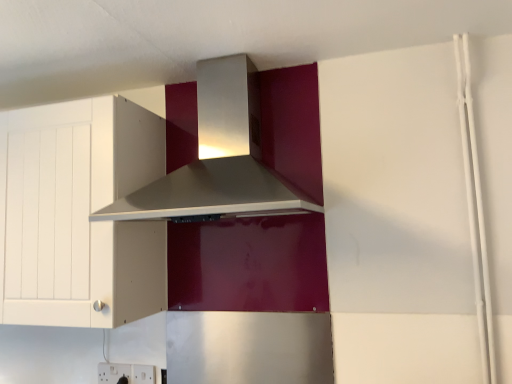
Describe the element at coordinates (113, 372) in the screenshot. I see `white plastic electric outlet at lower left, marked as the 1th electric outlet in a left-to-right arrangement` at that location.

Where is `white plastic electric outlet at lower center, placed as the 1th electric outlet when sorted from right to left`? Image resolution: width=512 pixels, height=384 pixels. white plastic electric outlet at lower center, placed as the 1th electric outlet when sorted from right to left is located at coordinates (143, 374).

What do you see at coordinates (143, 374) in the screenshot?
I see `white plastic electric outlet at lower center, placed as the 1th electric outlet when sorted from right to left` at bounding box center [143, 374].

The height and width of the screenshot is (384, 512). Find the location of `satin silver range hood at upper center`. satin silver range hood at upper center is located at coordinates (211, 194).

I want to click on white plastic electric outlet at lower left, marked as the 1th electric outlet in a left-to-right arrangement, so pos(113,372).

Considering the sizes of white plastic electric outlet at lower left, marked as the 1th electric outlet in a left-to-right arrangement, and white matte cabinet at left in the image, is white plastic electric outlet at lower left, marked as the 1th electric outlet in a left-to-right arrangement, taller or shorter than white matte cabinet at left?

Considering their sizes, white plastic electric outlet at lower left, marked as the 1th electric outlet in a left-to-right arrangement, has less height than white matte cabinet at left.

From a real-world perspective, is white plastic electric outlet at lower left, marked as the 1th electric outlet in a left-to-right arrangement, located beneath white matte cabinet at left?

Yes, from a real-world perspective, white plastic electric outlet at lower left, marked as the 1th electric outlet in a left-to-right arrangement, is under white matte cabinet at left.

Based on their positions, is white plastic electric outlet at lower left, marked as the 1th electric outlet in a left-to-right arrangement, located to the left or right of satin silver range hood at upper center?

Based on their positions, white plastic electric outlet at lower left, marked as the 1th electric outlet in a left-to-right arrangement, is located to the left of satin silver range hood at upper center.

From a real-world perspective, is white plastic electric outlet at lower left, marked as the 1th electric outlet in a left-to-right arrangement, located higher than satin silver range hood at upper center?

Actually, white plastic electric outlet at lower left, marked as the 1th electric outlet in a left-to-right arrangement, is physically below satin silver range hood at upper center in the real world.

How different are the orientations of white plastic electric outlet at lower left, the second electric outlet viewed from the right, and satin silver range hood at upper center in degrees?

1.5 degrees separate the facing orientations of white plastic electric outlet at lower left, the second electric outlet viewed from the right, and satin silver range hood at upper center.

Is satin silver range hood at upper center far away from white matte cabinet at left?

They are positioned close to each other.

From a real-world perspective, which object stands above the other?

From a 3D spatial view, satin silver range hood at upper center is above.

Considering the relative sizes of satin silver range hood at upper center and white matte cabinet at left in the image provided, is satin silver range hood at upper center wider than white matte cabinet at left?

Indeed, satin silver range hood at upper center has a greater width compared to white matte cabinet at left.

Is white plastic electric outlet at lower center, placed as the 1th electric outlet when sorted from right to left, far away from white plastic electric outlet at lower left, marked as the 1th electric outlet in a left-to-right arrangement?

That's not correct — white plastic electric outlet at lower center, placed as the 1th electric outlet when sorted from right to left, is a little close to white plastic electric outlet at lower left, marked as the 1th electric outlet in a left-to-right arrangement.

Between point (137, 373) and point (116, 364), which one is positioned in front?

The point (137, 373) is closer to the camera.

Could you tell me if white plastic electric outlet at lower center, the second electric outlet from the left, is turned towards white plastic electric outlet at lower left, marked as the 1th electric outlet in a left-to-right arrangement?

No, white plastic electric outlet at lower center, the second electric outlet from the left, is not facing towards white plastic electric outlet at lower left, marked as the 1th electric outlet in a left-to-right arrangement.

How many degrees apart are the facing directions of white plastic electric outlet at lower center, placed as the 1th electric outlet when sorted from right to left, and white plastic electric outlet at lower left, the second electric outlet viewed from the right?

They differ by 0.0294 degrees in their facing directions.

Is white plastic electric outlet at lower center, placed as the 1th electric outlet when sorted from right to left, with white matte cabinet at left?

No, white plastic electric outlet at lower center, placed as the 1th electric outlet when sorted from right to left, is not with white matte cabinet at left.

Image resolution: width=512 pixels, height=384 pixels. What are the coordinates of `cabinetry that appears in front of the white plastic electric outlet at lower center, the second electric outlet from the left` in the screenshot? It's located at (78, 214).

Measure the distance between white plastic electric outlet at lower center, placed as the 1th electric outlet when sorted from right to left, and white matte cabinet at left.

white plastic electric outlet at lower center, placed as the 1th electric outlet when sorted from right to left, and white matte cabinet at left are 24.44 inches apart from each other.

Considering the sizes of objects white matte cabinet at left and white plastic electric outlet at lower left, marked as the 1th electric outlet in a left-to-right arrangement, in the image provided, who is wider, white matte cabinet at left or white plastic electric outlet at lower left, marked as the 1th electric outlet in a left-to-right arrangement,?

white matte cabinet at left.

Would you say white matte cabinet at left is a long distance from white plastic electric outlet at lower left, marked as the 1th electric outlet in a left-to-right arrangement?

No.

Are white plastic electric outlet at lower center, the second electric outlet from the left, and satin silver range hood at upper center making contact?

white plastic electric outlet at lower center, the second electric outlet from the left, is not next to satin silver range hood at upper center, and they're not touching.

Is point (142, 374) positioned in front of point (102, 216)?

No, (142, 374) is behind (102, 216).

Looking at this image, is satin silver range hood at upper center a part of white plastic electric outlet at lower center, the second electric outlet from the left?

No, white plastic electric outlet at lower center, the second electric outlet from the left, does not contain satin silver range hood at upper center.

Can you confirm if white plastic electric outlet at lower center, placed as the 1th electric outlet when sorted from right to left, is taller than satin silver range hood at upper center?

In fact, white plastic electric outlet at lower center, placed as the 1th electric outlet when sorted from right to left, may be shorter than satin silver range hood at upper center.

From the white matte cabinet at left, count 2nd electric outlets backward and point to it. Please provide its 2D coordinates.

[(113, 372)]

This screenshot has width=512, height=384. What are the coordinates of `home appliance that is above the white plastic electric outlet at lower left, the second electric outlet viewed from the right (from the image's perspective)` in the screenshot? It's located at (211, 194).

Based on their spatial positions, is satin silver range hood at upper center or white plastic electric outlet at lower center, the second electric outlet from the left, further from white matte cabinet at left?

white plastic electric outlet at lower center, the second electric outlet from the left, lies further to white matte cabinet at left than the other object.

Based on their spatial positions, is satin silver range hood at upper center or white plastic electric outlet at lower left, the second electric outlet viewed from the right, closer to white plastic electric outlet at lower center, the second electric outlet from the left?

white plastic electric outlet at lower left, the second electric outlet viewed from the right, lies closer to white plastic electric outlet at lower center, the second electric outlet from the left, than the other object.

Considering their positions, is white plastic electric outlet at lower left, marked as the 1th electric outlet in a left-to-right arrangement, positioned further to white plastic electric outlet at lower center, placed as the 1th electric outlet when sorted from right to left, than white matte cabinet at left?

white matte cabinet at left.

Considering their positions, is white matte cabinet at left positioned closer to white plastic electric outlet at lower center, the second electric outlet from the left, than satin silver range hood at upper center?

white matte cabinet at left is positioned closer to the anchor white plastic electric outlet at lower center, the second electric outlet from the left.

When comparing their distances from satin silver range hood at upper center, does white plastic electric outlet at lower center, placed as the 1th electric outlet when sorted from right to left, or white plastic electric outlet at lower left, the second electric outlet viewed from the right, seem further?

Based on the image, white plastic electric outlet at lower left, the second electric outlet viewed from the right, appears to be further to satin silver range hood at upper center.

Based on their spatial positions, is white plastic electric outlet at lower center, the second electric outlet from the left, or satin silver range hood at upper center further from white plastic electric outlet at lower left, marked as the 1th electric outlet in a left-to-right arrangement?

The object further to white plastic electric outlet at lower left, marked as the 1th electric outlet in a left-to-right arrangement, is satin silver range hood at upper center.

Considering their positions, is white matte cabinet at left positioned further to white plastic electric outlet at lower left, the second electric outlet viewed from the right, than white plastic electric outlet at lower center, the second electric outlet from the left?

Among the two, white matte cabinet at left is located further to white plastic electric outlet at lower left, the second electric outlet viewed from the right.

Estimate the real-world distances between objects in this image. Which object is closer to white plastic electric outlet at lower center, the second electric outlet from the left, white matte cabinet at left or white plastic electric outlet at lower left, marked as the 1th electric outlet in a left-to-right arrangement?

white plastic electric outlet at lower left, marked as the 1th electric outlet in a left-to-right arrangement, is positioned closer to the anchor white plastic electric outlet at lower center, the second electric outlet from the left.

You are a GUI agent. You are given a task and a screenshot of the screen. Output one action in this format:
    pyautogui.click(x=<x>, y=<y>)
    Task: Click on the cabinetry that lies between satin silver range hood at upper center and white plastic electric outlet at lower left, the second electric outlet viewed from the right, from top to bottom
    The width and height of the screenshot is (512, 384).
    Given the screenshot: What is the action you would take?
    pyautogui.click(x=78, y=214)

At what (x,y) coordinates should I click in order to perform the action: click on cabinetry between satin silver range hood at upper center and white plastic electric outlet at lower center, placed as the 1th electric outlet when sorted from right to left, vertically. Please return your answer as a coordinate pair (x, y). The height and width of the screenshot is (384, 512). Looking at the image, I should click on (78, 214).

Image resolution: width=512 pixels, height=384 pixels. I want to click on electric outlet between satin silver range hood at upper center and white plastic electric outlet at lower left, marked as the 1th electric outlet in a left-to-right arrangement, vertically, so click(x=143, y=374).

Image resolution: width=512 pixels, height=384 pixels. What are the coordinates of `electric outlet between white matte cabinet at left and white plastic electric outlet at lower left, marked as the 1th electric outlet in a left-to-right arrangement, in the up-down direction` in the screenshot? It's located at (143, 374).